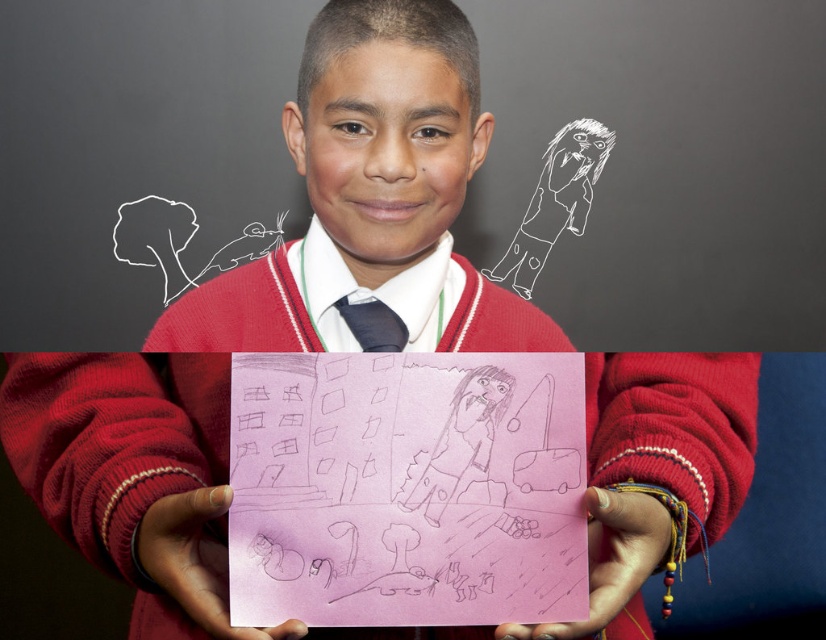
Question: Does smooth skin hand at center come in front of black satin tie at center?

Choices:
 (A) yes
 (B) no

Answer: (A)

Question: Among these objects, which one is nearest to the camera?

Choices:
 (A) smooth skin hand at center
 (B) black satin tie at center
 (C) pink paper at center

Answer: (C)

Question: Which of these objects is positioned farthest from the smooth skin hand at center?

Choices:
 (A) pink paper at center
 (B) black satin tie at center

Answer: (B)

Question: Is smooth skin hand at center closer to camera compared to black satin tie at center?

Choices:
 (A) yes
 (B) no

Answer: (A)

Question: Does pink paper at center appear under black satin tie at center?

Choices:
 (A) yes
 (B) no

Answer: (A)

Question: Which of the following is the closest to the observer?

Choices:
 (A) black satin tie at center
 (B) smooth skin hand at center

Answer: (B)